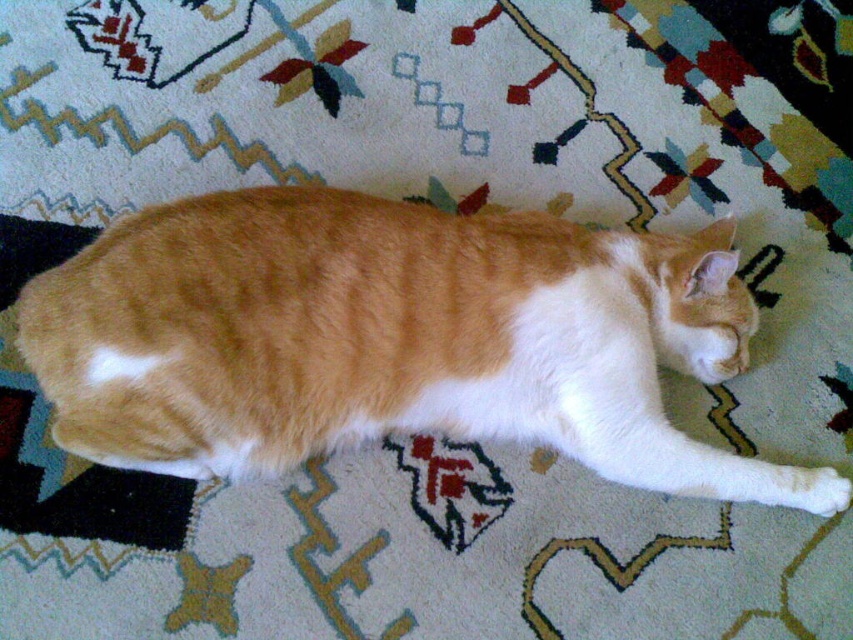
Does orange tabby cat at center lie behind white fluffy paw at lower right?

No, orange tabby cat at center is closer to the viewer.

Is orange tabby cat at center thinner than white fluffy paw at lower right?

No, orange tabby cat at center is not thinner than white fluffy paw at lower right.

Who is more forward, (x=277, y=285) or (x=802, y=474)?

Result: Point (x=277, y=285)

Locate an element on the screen. Image resolution: width=853 pixels, height=640 pixels. orange tabby cat at center is located at coordinates point(387,337).